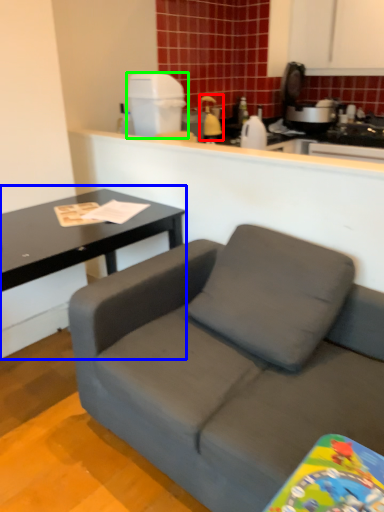
Question: Which is nearer to the appliance (highlighted by a red box)? coffee table (highlighted by a blue box) or appliance (highlighted by a green box).

Choices:
 (A) coffee table
 (B) appliance

Answer: (B)